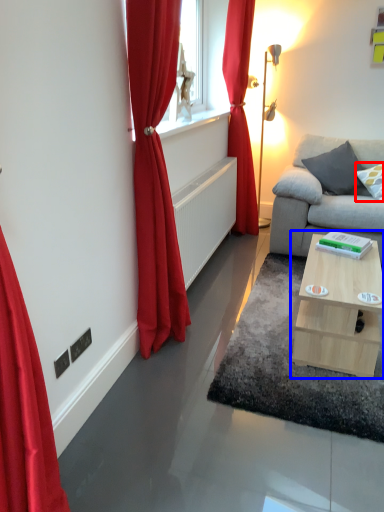
Question: Which object appears farthest to the camera in this image, pillow (highlighted by a red box) or table (highlighted by a blue box)?

Choices:
 (A) pillow
 (B) table

Answer: (A)